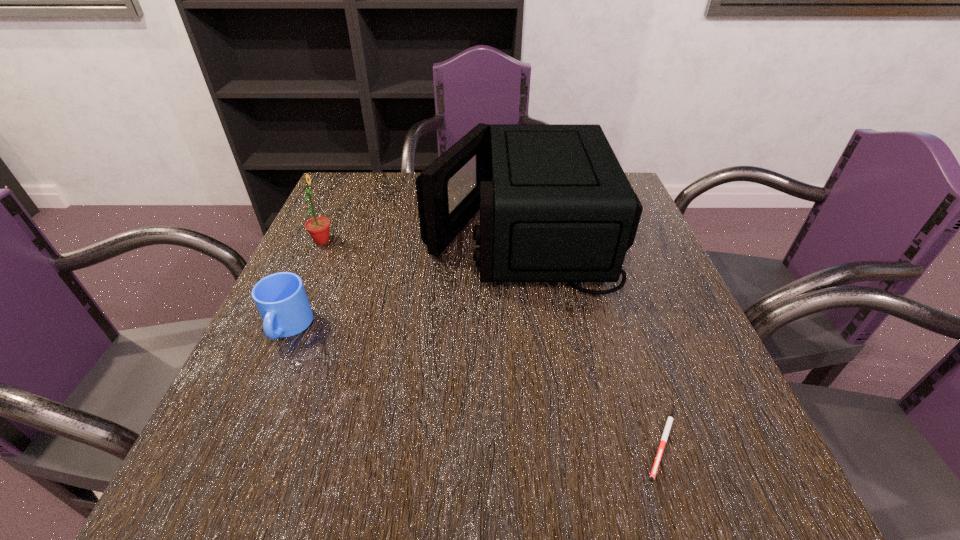
Find the location of `vacant point located on the side of the third tallest object with the handle`. vacant point located on the side of the third tallest object with the handle is located at coordinates (253, 404).

Identify the location of object that is at the far edge. (555, 205).

You are a GUI agent. You are given a task and a screenshot of the screen. Output one action in this format:
    pyautogui.click(x=<x>, y=<y>)
    Task: Click on the object positioned at the near edge
    This screenshot has width=960, height=540.
    Given the screenshot: What is the action you would take?
    pyautogui.click(x=670, y=419)

Identify the location of sunflower located at the left edge. [318, 227].

In order to click on mug present at the left edge in this screenshot , I will do click(x=281, y=299).

The height and width of the screenshot is (540, 960). In order to click on microwave oven situated at the right edge in this screenshot , I will do `click(555, 205)`.

Find the location of `pen at the right edge`. pen at the right edge is located at coordinates (670, 419).

Where is `object that is positioned at the far right corner`? The width and height of the screenshot is (960, 540). object that is positioned at the far right corner is located at coordinates (555, 205).

Where is `object located at the near right corner`? object located at the near right corner is located at coordinates (670, 419).

In the image, there is a desktop. Where is `free space at the near edge`? The image size is (960, 540). free space at the near edge is located at coordinates (531, 510).